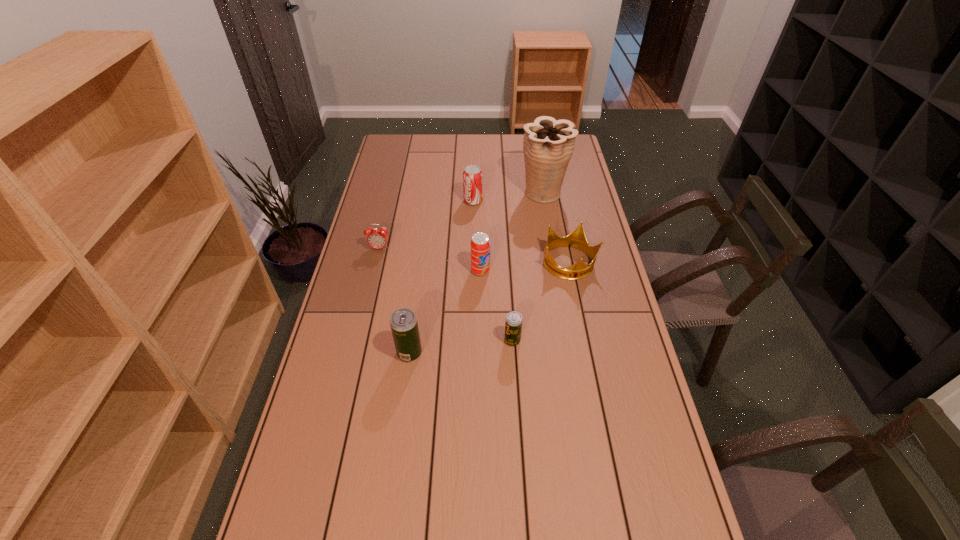
Locate an element on the screen. The height and width of the screenshot is (540, 960). the left beer can is located at coordinates (403, 322).

The image size is (960, 540). I want to click on the taller beer can, so click(403, 322).

Where is `the right beer can`? the right beer can is located at coordinates (513, 324).

Identify the location of the shorter beer can. The height and width of the screenshot is (540, 960). (513, 324).

At what (x,y) coordinates should I click in order to perform the action: click on the farther soda can. Please return your answer as a coordinate pair (x, y). This screenshot has width=960, height=540. Looking at the image, I should click on (472, 176).

What are the coordinates of `the tallest object` in the screenshot? It's located at (548, 145).

Locate an element on the screen. the nearer soda can is located at coordinates (480, 243).

This screenshot has height=540, width=960. What are the coordinates of `alarm clock` in the screenshot? It's located at (377, 238).

Where is `crown`? The height and width of the screenshot is (540, 960). crown is located at coordinates (576, 239).

This screenshot has height=540, width=960. In order to click on free space located 0.300m on the back of the left beer can in this screenshot , I will do [420, 272].